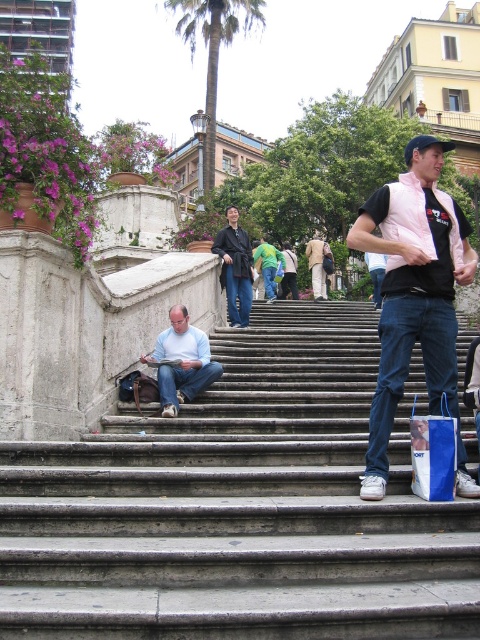
Question: From the image, what is the correct spatial relationship of pink fabric vest at upper right in relation to brown textured palm tree at upper center?

Choices:
 (A) above
 (B) below

Answer: (B)

Question: Among these points, which one is nearest to the camera?

Choices:
 (A) (247, 20)
 (B) (368, 541)

Answer: (B)

Question: Which point is closer to the camera?

Choices:
 (A) dark brown leather jacket at center
 (B) brown textured palm tree at upper center
 (C) pink fabric vest at upper right

Answer: (C)

Question: In this image, where is pink fabric vest at upper right located relative to brown textured palm tree at upper center?

Choices:
 (A) below
 (B) above

Answer: (A)

Question: Observing the image, what is the correct spatial positioning of blue paper bag at lower right in reference to dark brown leather jacket at center?

Choices:
 (A) right
 (B) left

Answer: (A)

Question: Which of the following is the closest to the observer?

Choices:
 (A) light brown textured jacket at center
 (B) smooth concrete stairs at center
 (C) dark brown leather jacket at center

Answer: (B)